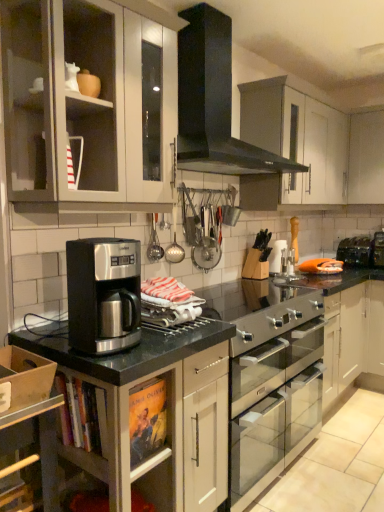
Question: Considering the relative sizes of satin black coffee maker at center and black metallic toaster at right, placed as the second appliance when sorted from left to right, in the image provided, is satin black coffee maker at center wider than black metallic toaster at right, placed as the second appliance when sorted from left to right,?

Choices:
 (A) no
 (B) yes

Answer: (A)

Question: From a real-world perspective, is satin black coffee maker at center physically above black metallic toaster at right, which is counted as the first appliance, starting from the top?

Choices:
 (A) yes
 (B) no

Answer: (A)

Question: Is satin black coffee maker at center directly adjacent to black metallic toaster at right, acting as the second appliance starting from the bottom?

Choices:
 (A) no
 (B) yes

Answer: (A)

Question: Does satin black coffee maker at center contain black metallic toaster at right, the 2th appliance in the front-to-back sequence?

Choices:
 (A) no
 (B) yes

Answer: (A)

Question: Is satin black coffee maker at center thinner than black metallic toaster at right, the 1th appliance when ordered from right to left?

Choices:
 (A) yes
 (B) no

Answer: (A)

Question: Is the position of satin black coffee maker at center more distant than that of black metallic toaster at right, which is counted as the first appliance, starting from the top?

Choices:
 (A) yes
 (B) no

Answer: (B)

Question: Considering the relative sizes of satin black coffee maker at center and satin silver oven at center, which is counted as the 1th appliance, starting from the front, in the image provided, is satin black coffee maker at center bigger than satin silver oven at center, which is counted as the 1th appliance, starting from the front,?

Choices:
 (A) yes
 (B) no

Answer: (B)

Question: From a real-world perspective, does satin black coffee maker at center sit lower than satin silver oven at center, positioned as the second appliance in right-to-left order?

Choices:
 (A) yes
 (B) no

Answer: (B)

Question: Is satin black coffee maker at center at the right side of satin silver oven at center, which is the 1th appliance in left-to-right order?

Choices:
 (A) no
 (B) yes

Answer: (A)

Question: Could you tell me if satin black coffee maker at center is facing satin silver oven at center, positioned as the second appliance in right-to-left order?

Choices:
 (A) no
 (B) yes

Answer: (A)

Question: Is satin black coffee maker at center in front of satin silver oven at center, positioned as the second appliance in back-to-front order?

Choices:
 (A) yes
 (B) no

Answer: (A)

Question: Does satin black coffee maker at center have a lesser height compared to satin silver oven at center, which is counted as the 1th appliance, starting from the front?

Choices:
 (A) no
 (B) yes

Answer: (A)

Question: Are white matte cabinet at upper right, which is the 1th cabinetry in right-to-left order, and black matte gas stove at upper center beside each other?

Choices:
 (A) no
 (B) yes

Answer: (A)